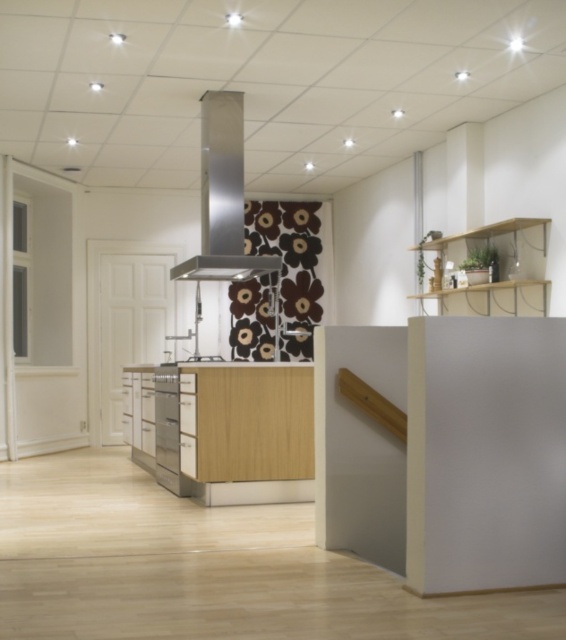
You are a chef standing in front of the kitchen island and want to reach both the stainless steel exhaust hood at center and the satin silver oven at center. Which one would you need to step forward to access?

The satin silver oven at center is located behind the stainless steel exhaust hood at center, so you would need to step forward to reach it since it is farther away.

You are a chef preparing to install a new ventilation system in the kitchen. You need to ensure that the satin silver oven at center is positioned correctly under the stainless steel exhaust hood at center. Based on the image, is the oven currently placed appropriately under the hood?

The stainless steel exhaust hood at center is located above the satin silver oven at center, so yes, the oven is placed appropriately under the hood.